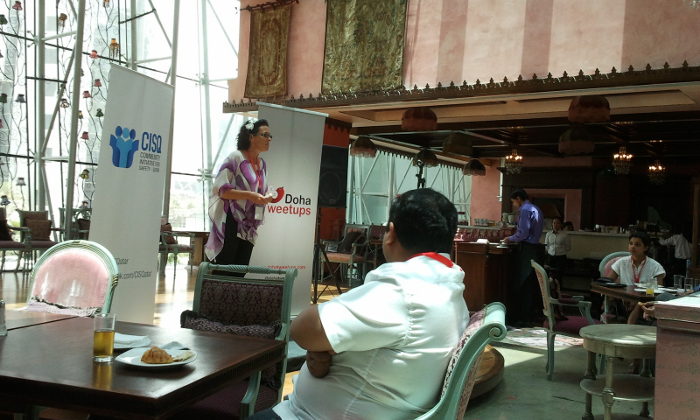
Locate an element on the screen. food on plate is located at coordinates (157, 358).